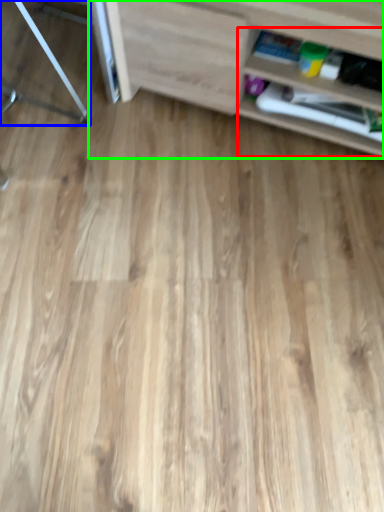
Question: Estimate the real-world distances between objects in this image. Which object is farther from shelf (highlighted by a red box), furniture (highlighted by a blue box) or shelf (highlighted by a green box)?

Choices:
 (A) furniture
 (B) shelf

Answer: (A)